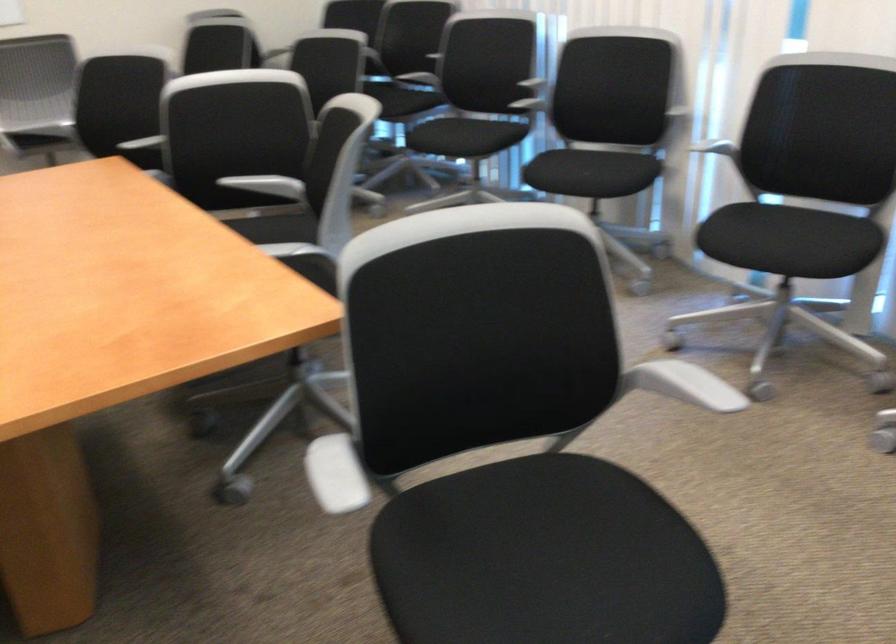
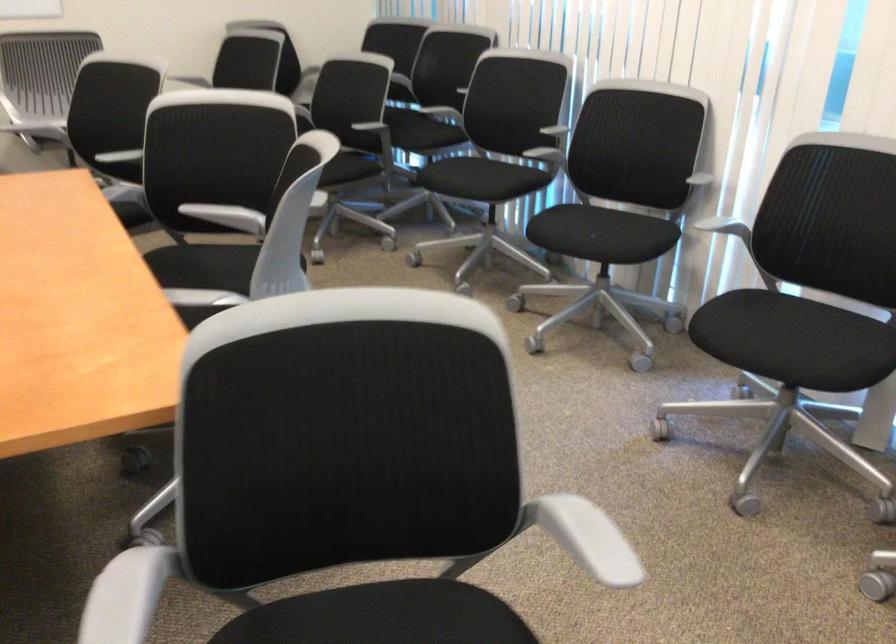
The images are taken continuously from a first-person perspective. In which direction are you moving?

The cameraman moved toward right, forward.